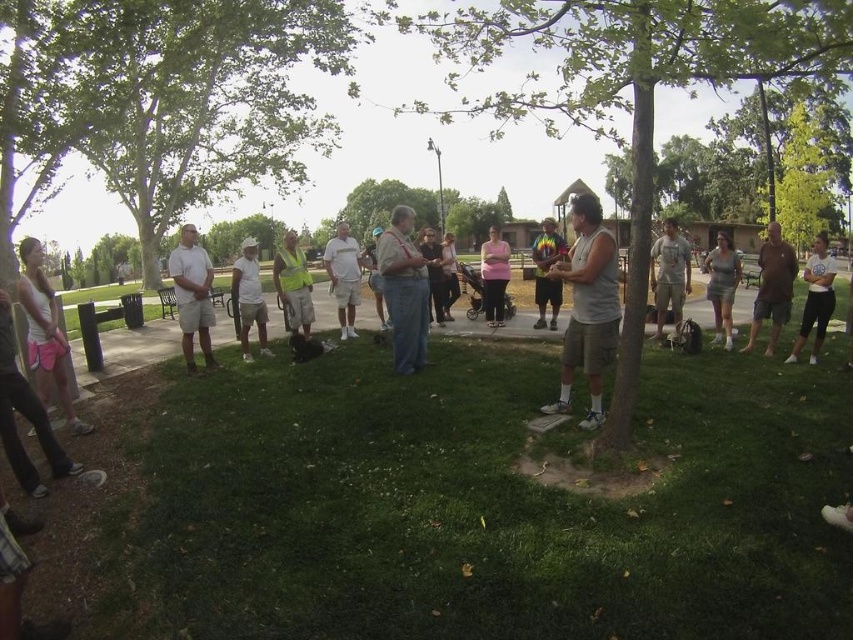
You are planning to buy a new shirt and want to know which one is wider between the white cotton shirt at right and the pink fabric shirt at center. Based on the image, which shirt is wider?

The white cotton shirt at right is wider than the pink fabric shirt at center according to the image description.